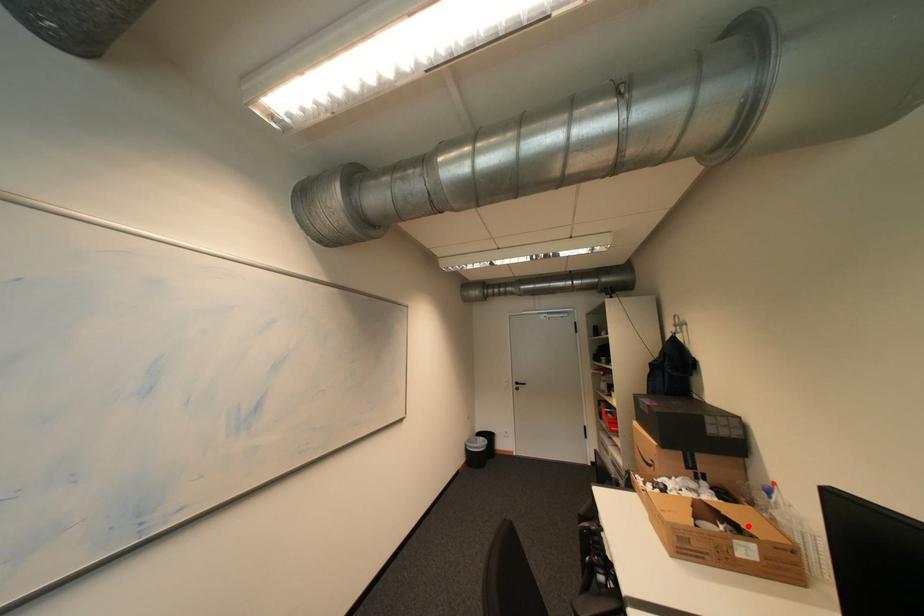
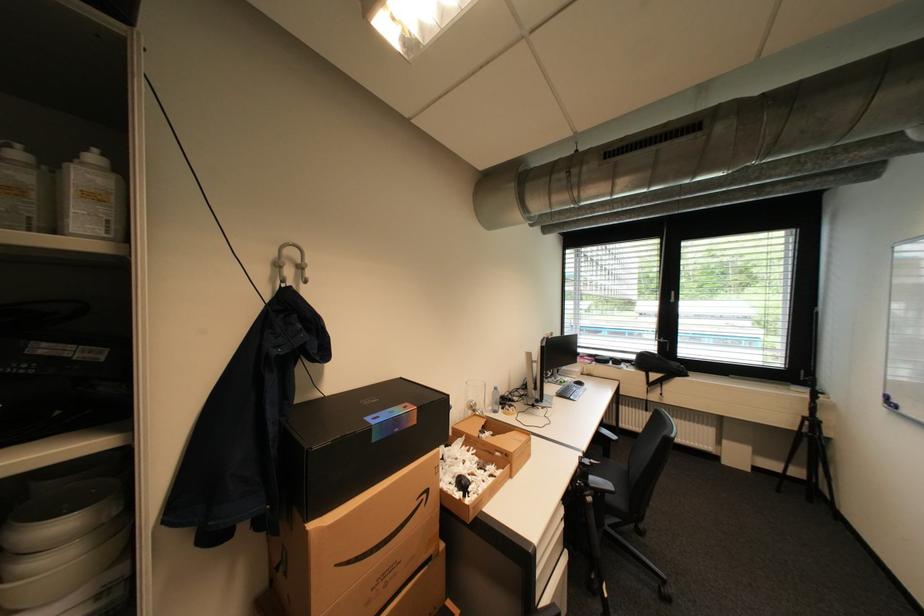
In the second image, find the point that corresponds to the highlighted location in the first image.

(492, 426)